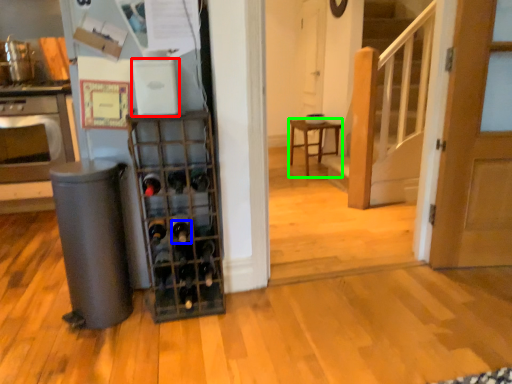
Question: Which object is the closest to the appliance (highlighted by a red box)? Choose among these: wine bottle (highlighted by a blue box) or furniture (highlighted by a green box).

Choices:
 (A) wine bottle
 (B) furniture

Answer: (A)